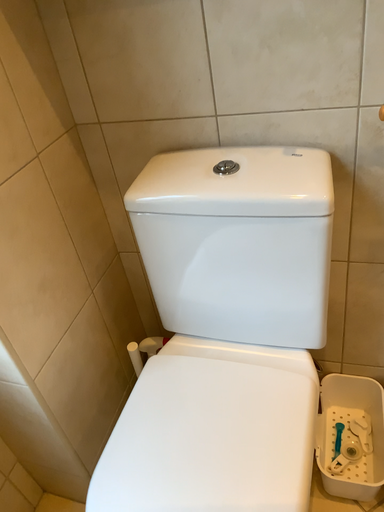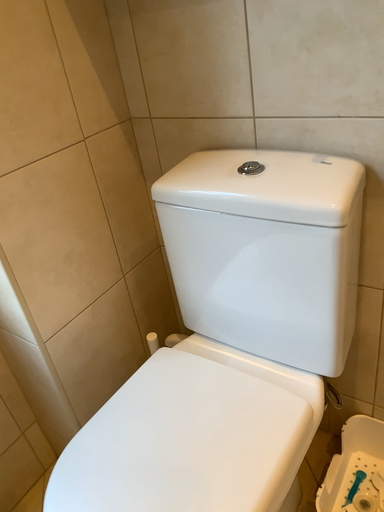
Question: How did the camera likely rotate when shooting the video?

Choices:
 (A) rotated right
 (B) rotated left

Answer: (B)